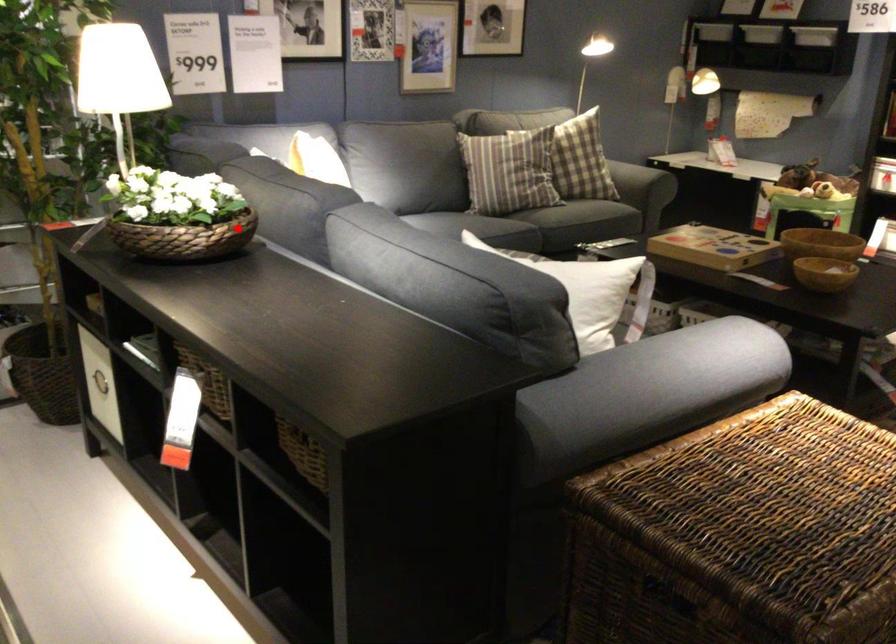
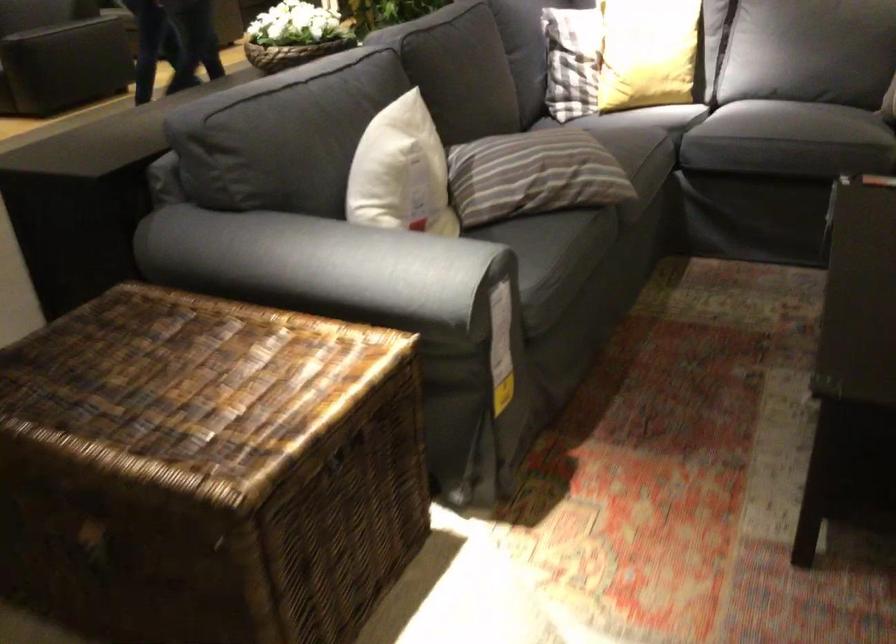
Question: A red point is marked in image1. In image2, is the corresponding 3D point closer to the camera or farther? Reply with the corresponding letter.

Choices:
 (A) The corresponding 3D point is closer.
 (B) The corresponding 3D point is farther.

Answer: (B)